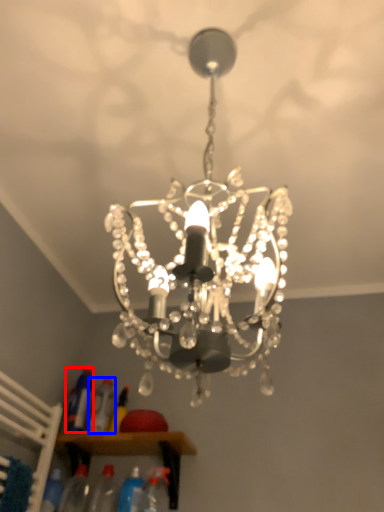
Question: Which object appears farthest to the camera in this image, bottle (highlighted by a red box) or bottle (highlighted by a blue box)?

Choices:
 (A) bottle
 (B) bottle

Answer: (A)